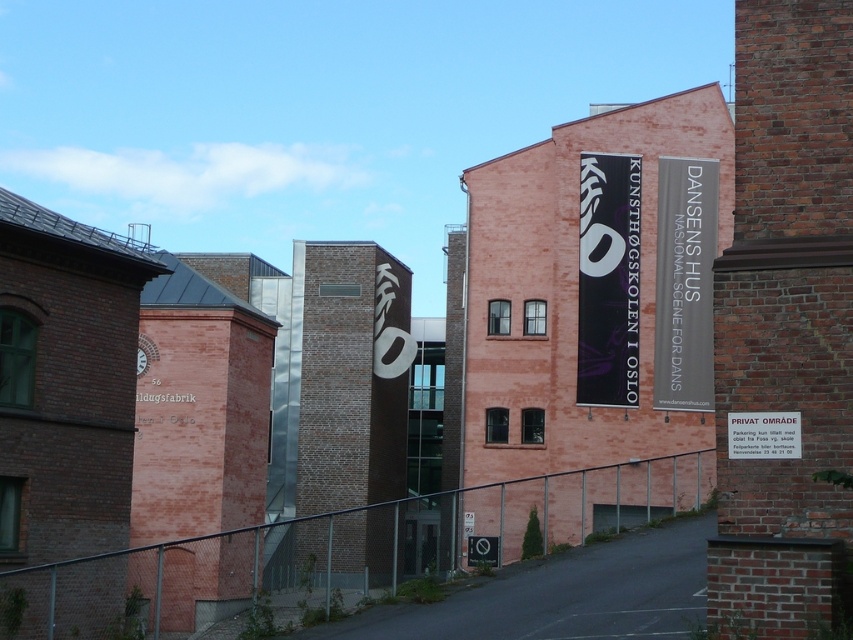
In the scene shown: You are a visitor standing in front of the two buildings and want to read both the black matte banner at center and the white plastic sign at lower center. Which object is easier to read from your current position?

The black matte banner at center is much taller than the white plastic sign at lower center, so it is easier to read from a distance.

You are a tourist standing in front of the two brick buildings. You see the black matte banner at center and the white plastic sign at lower center. Which one is positioned to the right of the other?

The black matte banner at center is positioned to the right of the white plastic sign at lower center.